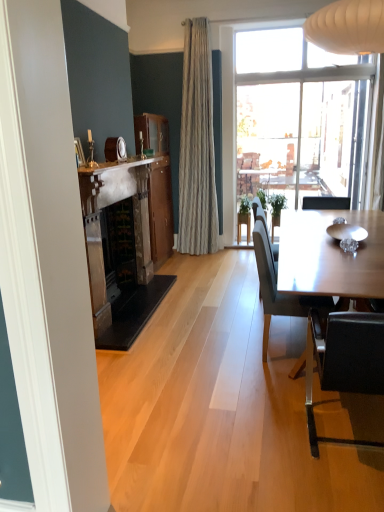
The image size is (384, 512). Find the location of `free space that is to the left of black leather chair at lower right, acting as the 1th chair starting from the front`. free space that is to the left of black leather chair at lower right, acting as the 1th chair starting from the front is located at coordinates (254, 431).